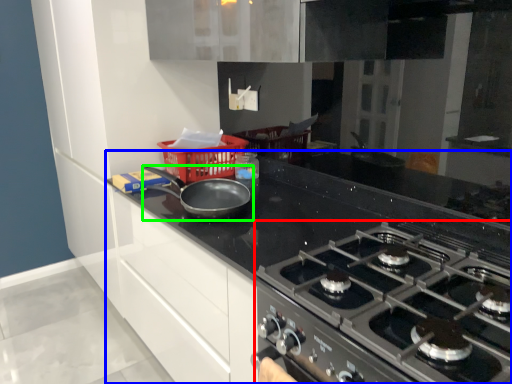
Question: Estimate the real-world distances between objects in this image. Which object is farther from gas stove (highlighted by a red box), countertop (highlighted by a blue box) or kitchen appliance (highlighted by a green box)?

Choices:
 (A) countertop
 (B) kitchen appliance

Answer: (B)